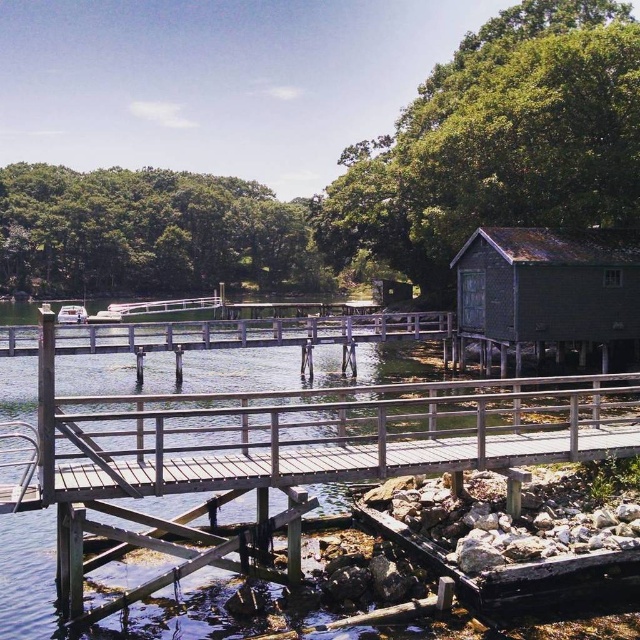
You are standing at the edge of the wooden dock in the lakeside scene. There are two points marked on the dock. One is at coordinates point [61,323] and the other at point [115,317]. If you want to move closer to the camera, which point should you walk towards?

You should walk towards point [61,323] because it is further to the camera than point [115,317]. Moving towards it would mean you are approaching the point that is already closer to your current position at the dock edge.